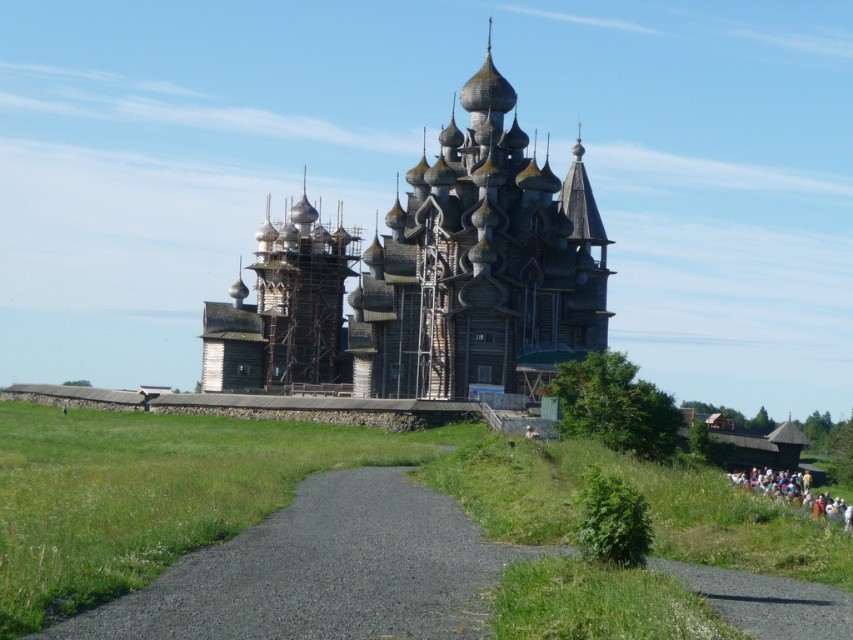
Can you confirm if wooden church at center is positioned to the right of white cotton crowd at lower right?

Incorrect, wooden church at center is not on the right side of white cotton crowd at lower right.

Is wooden church at center wider than white cotton crowd at lower right?

Correct, the width of wooden church at center exceeds that of white cotton crowd at lower right.

Who is more distant from viewer, (451, 182) or (776, 476)?

The point (451, 182) is behind.

Find the location of a particular element. The height and width of the screenshot is (640, 853). wooden church at center is located at coordinates (479, 266).